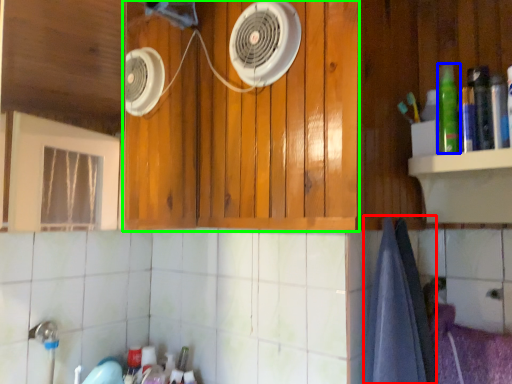
Question: Considering the real-world distances, which object is farthest from bath towel (highlighted by a red box)? bottle (highlighted by a blue box) or cabinetry (highlighted by a green box)?

Choices:
 (A) bottle
 (B) cabinetry

Answer: (B)